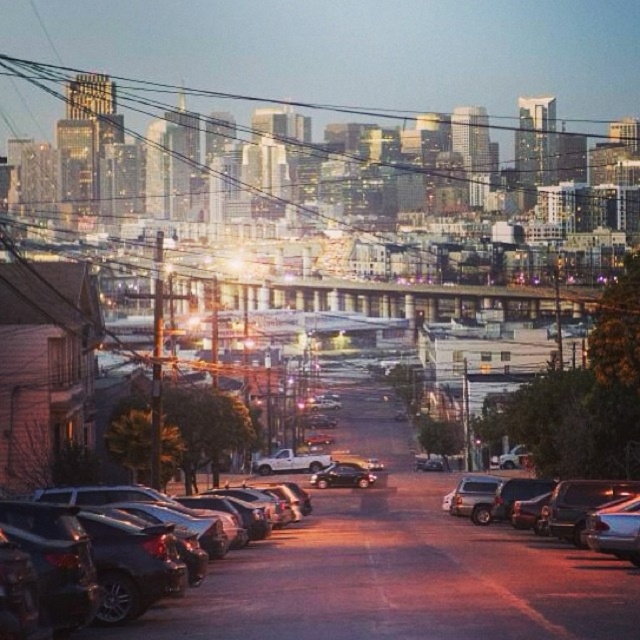
Which is in front, point (467, 506) or point (336, 486)?

Point (467, 506) is more forward.

Image resolution: width=640 pixels, height=640 pixels. Describe the element at coordinates (536, 502) in the screenshot. I see `shiny silver sedan at lower right` at that location.

What do you see at coordinates (536, 502) in the screenshot? This screenshot has width=640, height=640. I see `shiny silver sedan at lower right` at bounding box center [536, 502].

Where is `shiny silver sedan at lower right`? This screenshot has height=640, width=640. shiny silver sedan at lower right is located at coordinates [x=536, y=502].

Is metallic wire at upper center to the right of satin black sedan at center from the viewer's perspective?

No, metallic wire at upper center is not to the right of satin black sedan at center.

Image resolution: width=640 pixels, height=640 pixels. Find the location of `metallic wire at upper center`. metallic wire at upper center is located at coordinates click(x=234, y=99).

Does metallic wire at upper center come behind shiny black sedan at lower left?

Yes, it is.

Image resolution: width=640 pixels, height=640 pixels. Describe the element at coordinates (234, 99) in the screenshot. I see `metallic wire at upper center` at that location.

Between point (506, 125) and point (244, 547), which one is positioned behind?

The point (506, 125) is more distant.

Where is `metallic wire at upper center`? metallic wire at upper center is located at coordinates (234, 99).